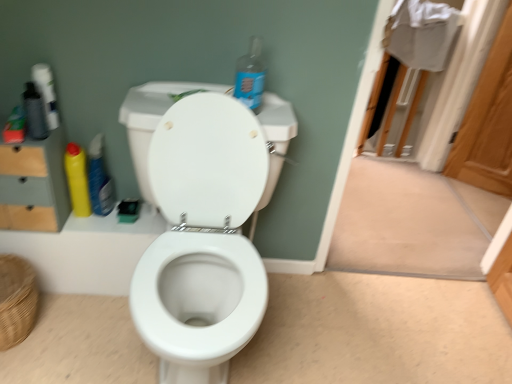
Where is `free space in front of yellow matte bottle at left, which ranks as the 1th cleaning product in left-to-right order`? This screenshot has height=384, width=512. free space in front of yellow matte bottle at left, which ranks as the 1th cleaning product in left-to-right order is located at coordinates (72, 225).